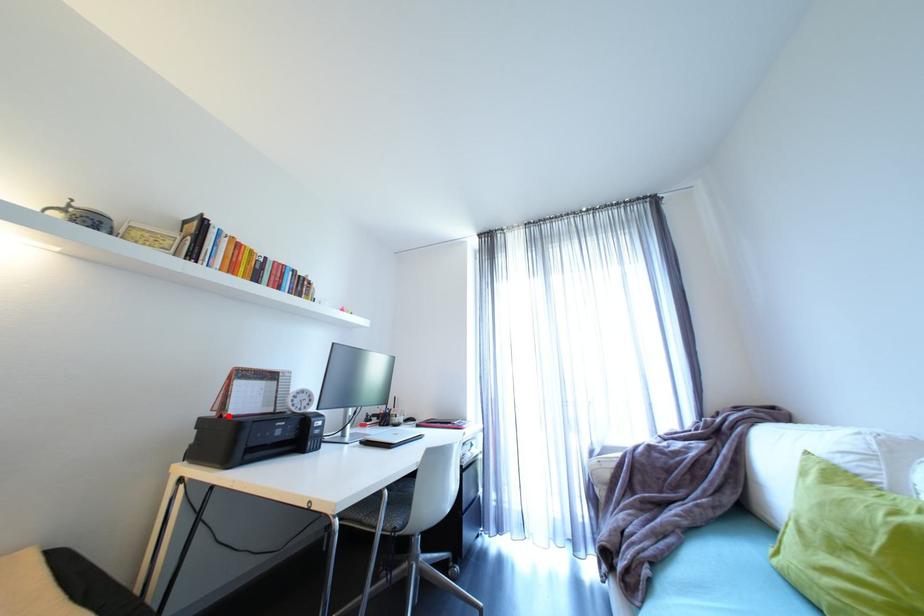
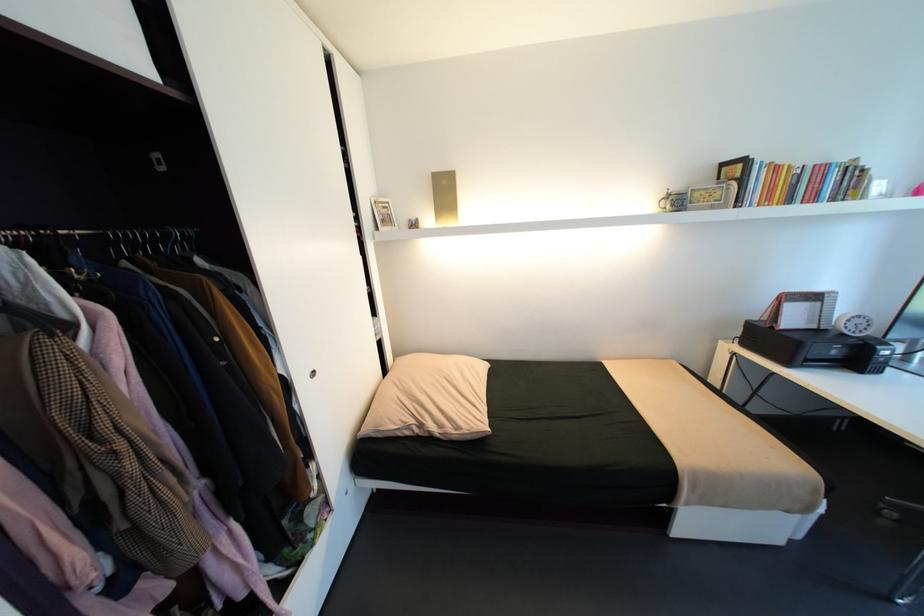
Where in the second image is the point corresponding to the highlighted location from the first image?

(779, 328)